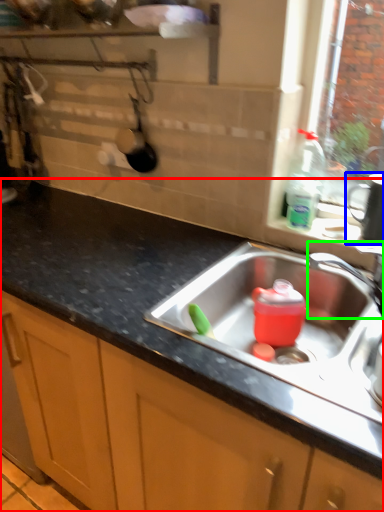
Question: Which is nearer to the countertop (highlighted by a red box)? appliance (highlighted by a blue box) or tap (highlighted by a green box).

Choices:
 (A) appliance
 (B) tap

Answer: (B)